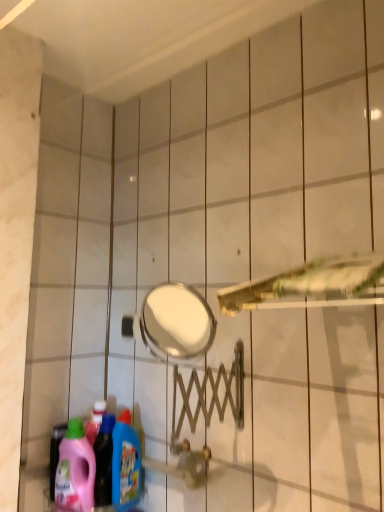
Question: From the image's perspective, is pink plastic detergent at lower left, the first cleaning product in the left-to-right sequence, above or below blue glossy detergent at lower left, arranged as the first cleaning product when viewed from the right?

Choices:
 (A) below
 (B) above

Answer: (A)

Question: Looking at the image, does pink plastic detergent at lower left, the first cleaning product in the left-to-right sequence, seem bigger or smaller compared to blue glossy detergent at lower left, the second cleaning product viewed from the left?

Choices:
 (A) small
 (B) big

Answer: (B)

Question: Which is farther from the metallic gold shower head at center?

Choices:
 (A) pink plastic detergent at lower left, the first cleaning product in the left-to-right sequence
 (B) blue glossy detergent at lower left, the second cleaning product viewed from the left

Answer: (A)

Question: Estimate the real-world distances between objects in this image. Which object is closer to the metallic gold shower head at center?

Choices:
 (A) blue glossy detergent at lower left, arranged as the first cleaning product when viewed from the right
 (B) pink plastic detergent at lower left, the first cleaning product in the left-to-right sequence

Answer: (A)